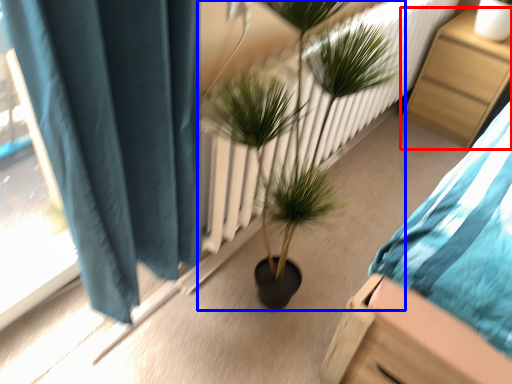
Question: Among these objects, which one is farthest to the camera, furniture (highlighted by a red box) or houseplant (highlighted by a blue box)?

Choices:
 (A) furniture
 (B) houseplant

Answer: (A)